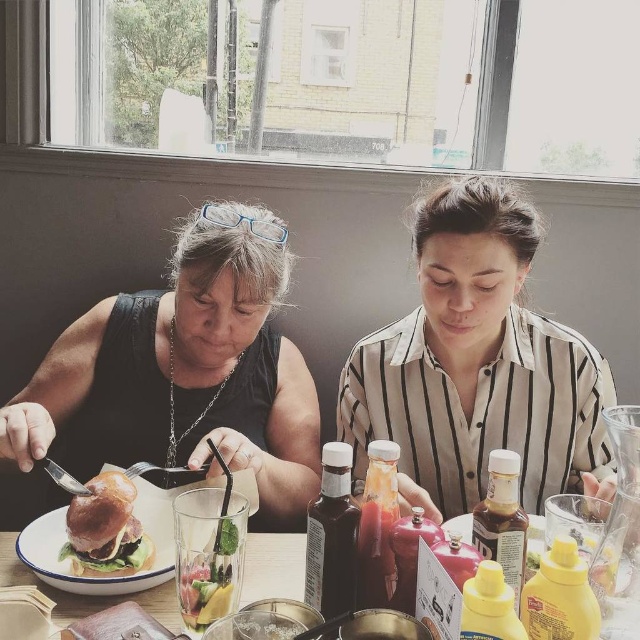
Locate an element on the screen. white striped shirt at center is located at coordinates (477, 365).

I want to click on white striped shirt at center, so click(477, 365).

Who is higher up, matte black shirt at left or white striped shirt at center?

Positioned higher is white striped shirt at center.

Locate an element on the screen. This screenshot has height=640, width=640. matte black shirt at left is located at coordinates (x=182, y=371).

The width and height of the screenshot is (640, 640). Find the location of `matte black shirt at left`. matte black shirt at left is located at coordinates (182, 371).

Which of these two, matte black shirt at left or golden brown bun at center, stands shorter?

golden brown bun at center

Is matte black shirt at left above golden brown bun at center?

Yes.

Find the location of a particular element. matte black shirt at left is located at coordinates [182, 371].

Identify the location of matte black shirt at left. (182, 371).